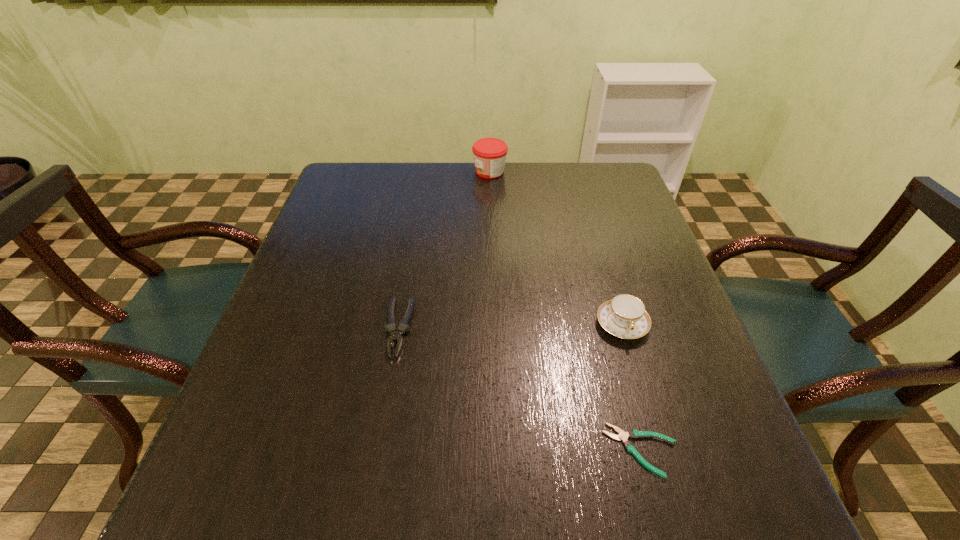
Locate an element on the screen. This screenshot has width=960, height=540. the tallest object is located at coordinates (489, 154).

Where is `jam`? Image resolution: width=960 pixels, height=540 pixels. jam is located at coordinates (489, 154).

Find the location of a particular element. The height and width of the screenshot is (540, 960). teacup is located at coordinates (624, 316).

The height and width of the screenshot is (540, 960). I want to click on the third tallest object, so click(395, 336).

You are a GUI agent. You are given a task and a screenshot of the screen. Output one action in this format:
    pyautogui.click(x=<x>, y=<y>)
    Task: Click on the farther pliers
    The height and width of the screenshot is (540, 960).
    Given the screenshot: What is the action you would take?
    pyautogui.click(x=395, y=336)

Identify the location of the right pliers. Image resolution: width=960 pixels, height=540 pixels. (633, 433).

Find the location of a particular element. The height and width of the screenshot is (540, 960). the shortest object is located at coordinates (633, 433).

You are a GUI agent. You are given a task and a screenshot of the screen. Output one action in this format:
    pyautogui.click(x=<x>, y=<y>)
    Task: Click on the free space located 0.360m on the label side of the farthest object
    
    Given the screenshot: What is the action you would take?
    pyautogui.click(x=355, y=172)

I want to click on free region located on the label side of the farthest object, so click(443, 172).

Where is `free space located on the label side of the farthest object`? free space located on the label side of the farthest object is located at coordinates (342, 172).